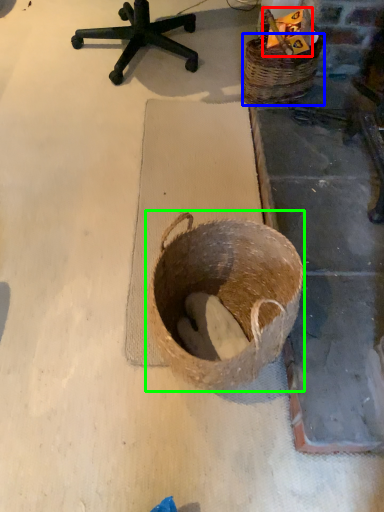
Question: Which object is the closest to the scrap (highlighted by a red box)? Choose among these: basket (highlighted by a blue box) or basket (highlighted by a green box).

Choices:
 (A) basket
 (B) basket

Answer: (A)